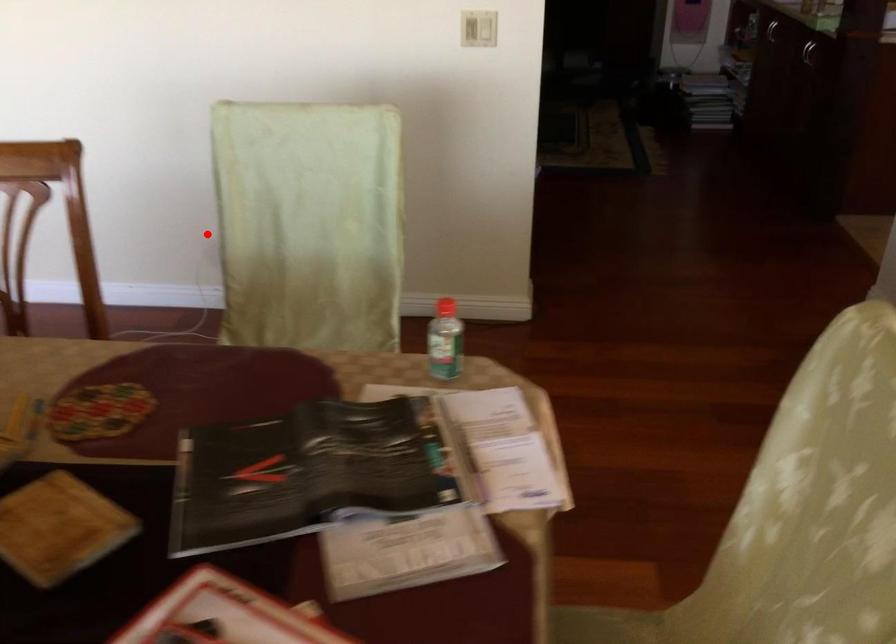
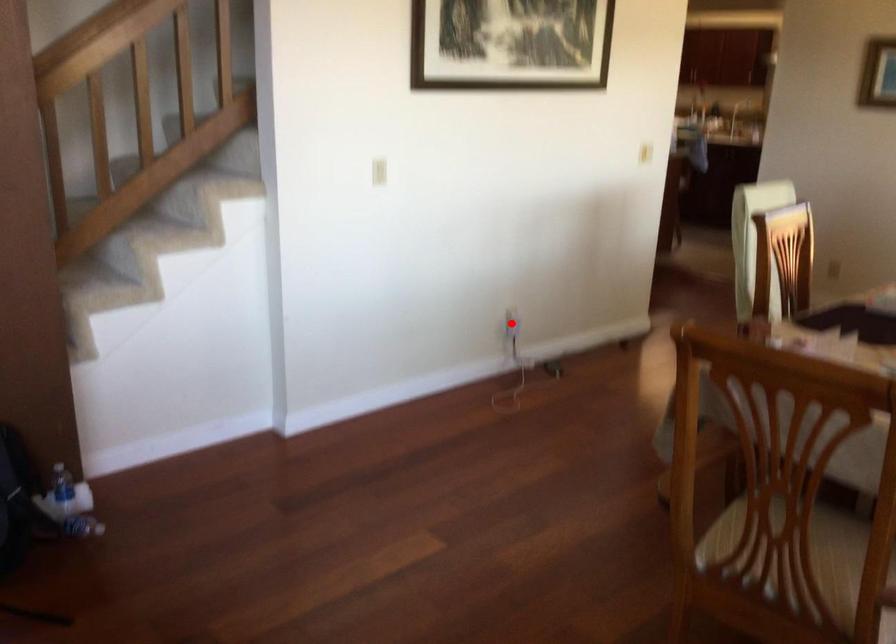
I am providing you with two images of the same scene from different viewpoints. A red point is marked on the first image and another point is marked on the second image. Do the highlighted points in image1 and image2 indicate the same real-world spot?

Yes